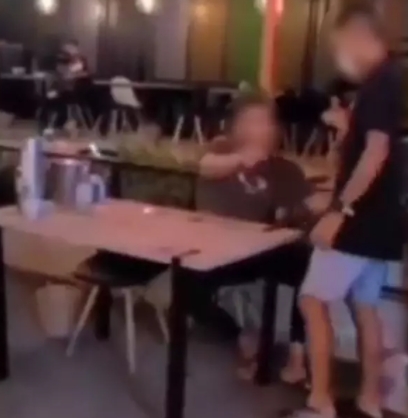
The height and width of the screenshot is (418, 408). I want to click on white chair, so click(128, 96).